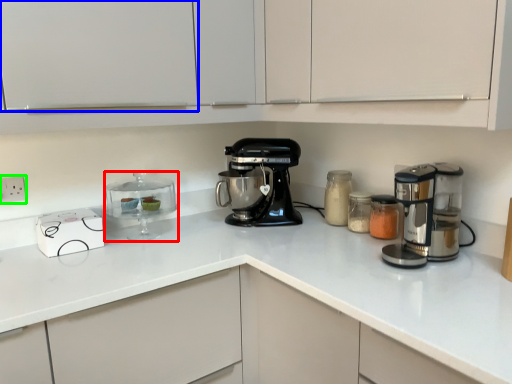
Question: Based on their relative distances, which object is farther from appliance (highlighted by a red box)? Choose from cabinetry (highlighted by a blue box) and electric outlet (highlighted by a green box).

Choices:
 (A) cabinetry
 (B) electric outlet

Answer: (A)